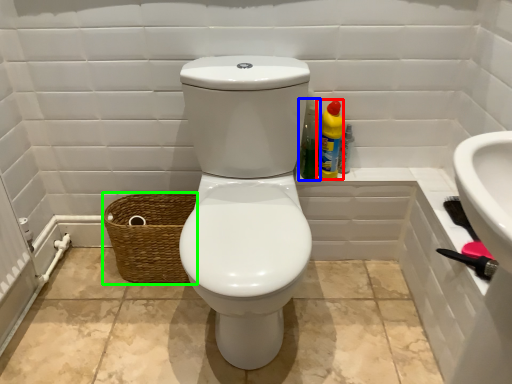
Question: Based on their relative distances, which object is farther from cleaning product (highlighted by a red box)? Choose from cleaning product (highlighted by a blue box) and basket (highlighted by a green box).

Choices:
 (A) cleaning product
 (B) basket

Answer: (B)